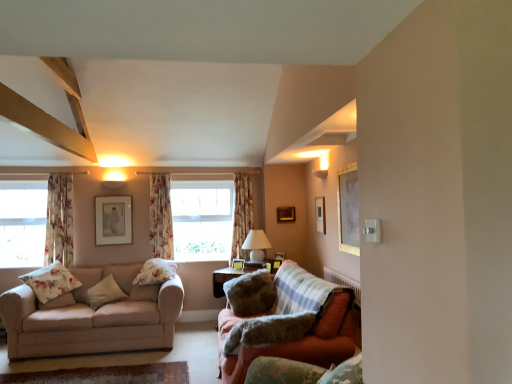
Question: From the image's perspective, is transparent glass window at left positioned above or below floral fabric pillow at center, arranged as the fourth pillow when viewed from the left?

Choices:
 (A) above
 (B) below

Answer: (A)

Question: Looking at their shapes, would you say transparent glass window at left is wider or thinner than floral fabric pillow at center, the third pillow from the right?

Choices:
 (A) wide
 (B) thin

Answer: (B)

Question: Which is farther from the wooden picture frame at upper center, which is counted as the 6th picture frame, starting from the back?

Choices:
 (A) velvet green armchair at lower right
 (B) floral fabric curtain at center, the second curtain positioned from the back
 (C) white glossy table lamp at center
 (D) wooden picture frame at center, positioned as the 5th picture frame in right-to-left order
 (E) floral fabric curtain at center, acting as the first curtain starting from the back

Answer: (B)

Question: Estimate the real-world distances between objects in this image. Which object is closer to the matte silver picture frame at upper center, which appears as the first picture frame when viewed from the left?

Choices:
 (A) beige fabric couch at left, the 1th studio couch positioned from the left
 (B) velvet orange couch at lower right, which is counted as the 1th studio couch, starting from the right
 (C) wooden picture frame at upper center, the 1th picture frame when ordered from back to front
 (D) floral fabric curtain at left, the 3th curtain when ordered from back to front
 (E) floral fabric pillow at center, the third pillow from the right

Answer: (D)